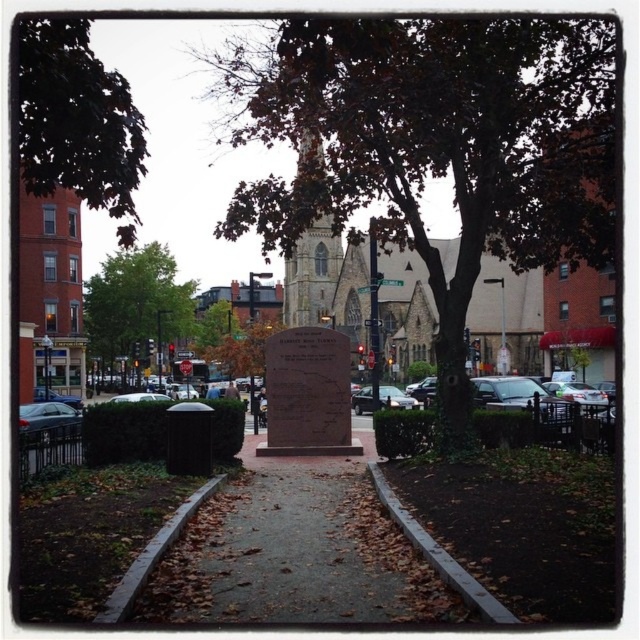
Question: From the image, what is the correct spatial relationship of brown stone church at center in relation to metallic silver sedan at center?

Choices:
 (A) above
 (B) below

Answer: (A)

Question: Based on their relative distances, which object is nearer to the silver metallic sedan at right?

Choices:
 (A) green leafy tree at upper left
 (B) brown stone church at center
 (C) matte black sedan at left

Answer: (A)

Question: Can you confirm if brown textured tree at center is positioned below green leafy tree at center?

Choices:
 (A) yes
 (B) no

Answer: (B)

Question: Which object is the farthest from the brown stone church at center?

Choices:
 (A) matte black sedan at left
 (B) green leafy tree at center
 (C) silver metallic sedan at right

Answer: (A)

Question: Which point is closer to the camera?

Choices:
 (A) green leafy tree at center
 (B) green leafy tree at upper left
 (C) brown stone church at center

Answer: (B)

Question: Is brown textured tree at center bigger than metallic silver sedan at center?

Choices:
 (A) no
 (B) yes

Answer: (B)